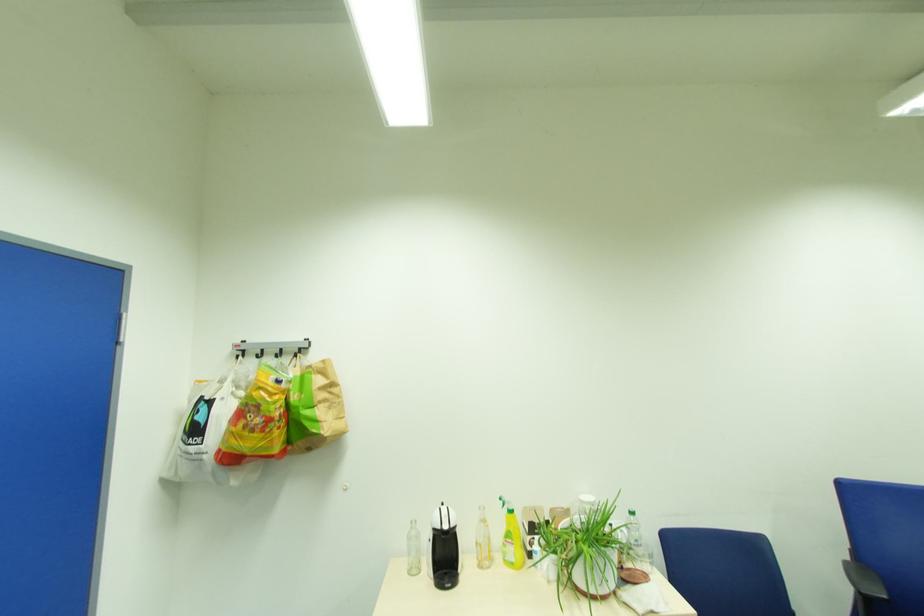
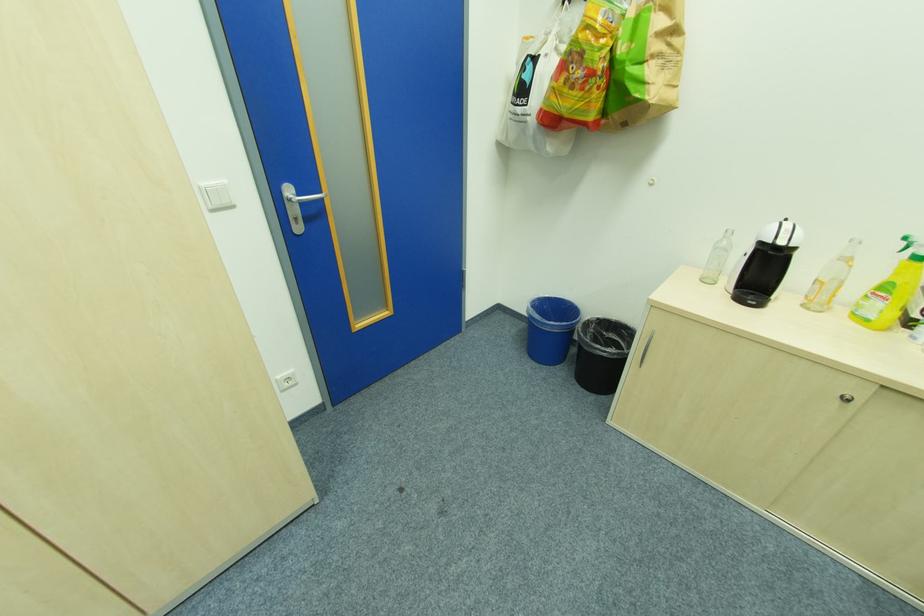
Find the pixel in the second image that matches [505,501] in the first image.

(909, 240)